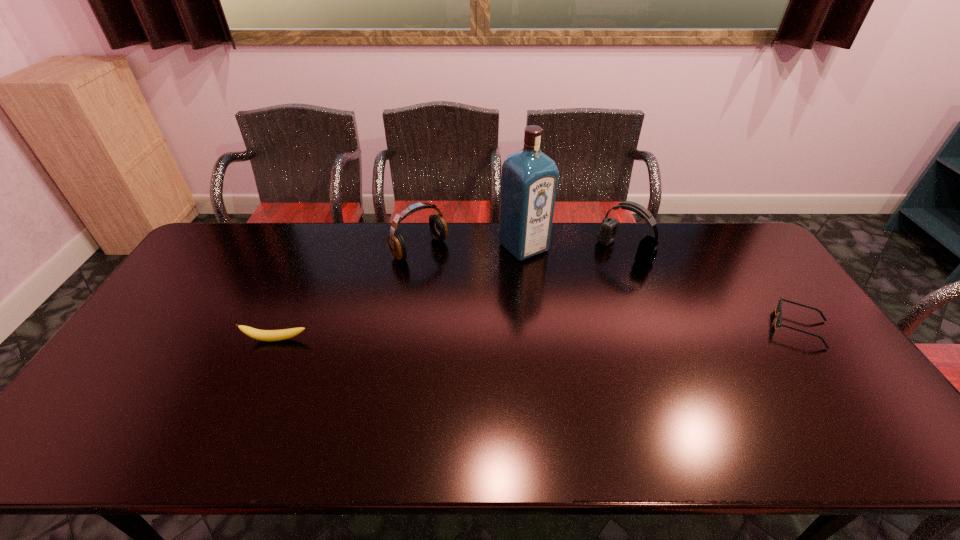
Locate an element on the screen. The height and width of the screenshot is (540, 960). vacant area that satisfies the following two spatial constraints: 1. on the front side of the rightmost object; 2. on the lenses of the fourth object from left to right is located at coordinates (654, 327).

The height and width of the screenshot is (540, 960). What are the coordinates of `free spot that satisfies the following two spatial constraints: 1. on the front side of the shortest object; 2. on the lenses of the liquor` in the screenshot? It's located at (533, 327).

Identify the location of blank space that satisfies the following two spatial constraints: 1. on the front side of the shortest object; 2. on the lenses of the liquor. This screenshot has height=540, width=960. (533, 327).